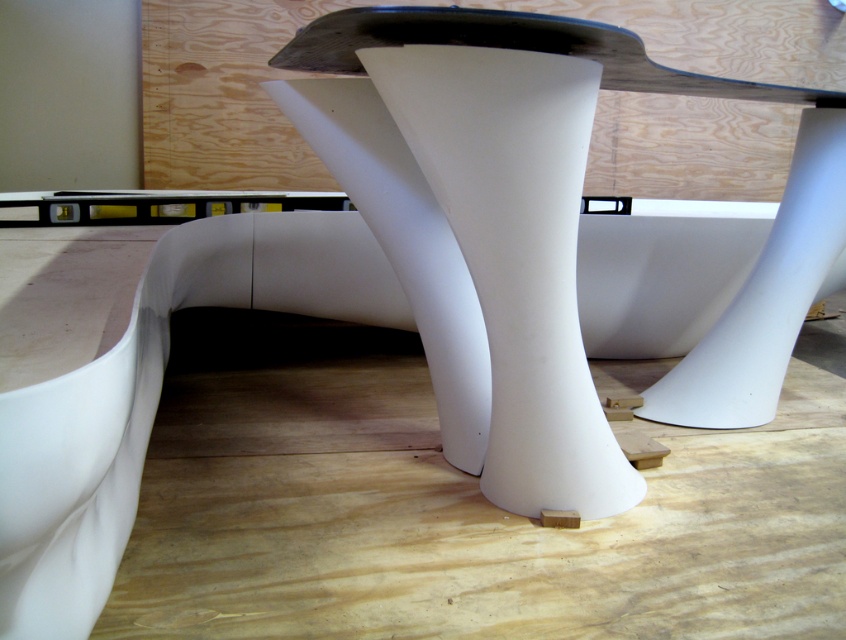
Does white glossy table at center have a greater width compared to white matte/soft plastic pillar at center?

Correct, the width of white glossy table at center exceeds that of white matte/soft plastic pillar at center.

Can you confirm if white glossy table at center is positioned above white matte/soft plastic pillar at center?

Yes, white glossy table at center is above white matte/soft plastic pillar at center.

Between point (732, 340) and point (536, 216), which one is positioned behind?

Point (732, 340)

The width and height of the screenshot is (846, 640). Find the location of `white glossy table at center`. white glossy table at center is located at coordinates (404, 244).